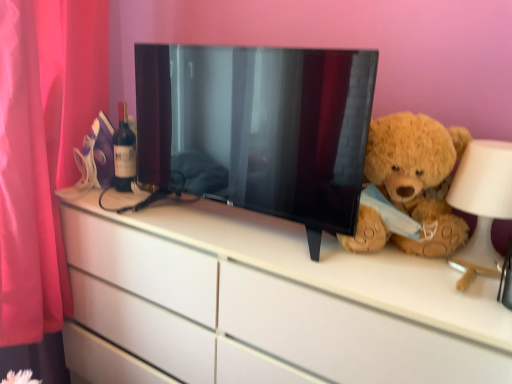
Question: In terms of size, does black glossy tv at center appear bigger or smaller than matte glass bottle at left?

Choices:
 (A) big
 (B) small

Answer: (A)

Question: From their relative heights in the image, would you say black glossy tv at center is taller or shorter than matte glass bottle at left?

Choices:
 (A) tall
 (B) short

Answer: (A)

Question: Estimate the real-world distances between objects in this image. Which object is farther from the white matte table lamp at right?

Choices:
 (A) matte glass bottle at left
 (B) pink fabric curtain at left
 (C) white glossy chest of drawers at center
 (D) black glossy tv at center
 (E) fuzzy brown teddy bear at right

Answer: (B)

Question: Which of these objects is positioned closest to the fuzzy brown teddy bear at right?

Choices:
 (A) white glossy chest of drawers at center
 (B) black glossy tv at center
 (C) pink fabric curtain at left
 (D) matte glass bottle at left
 (E) white matte table lamp at right

Answer: (E)